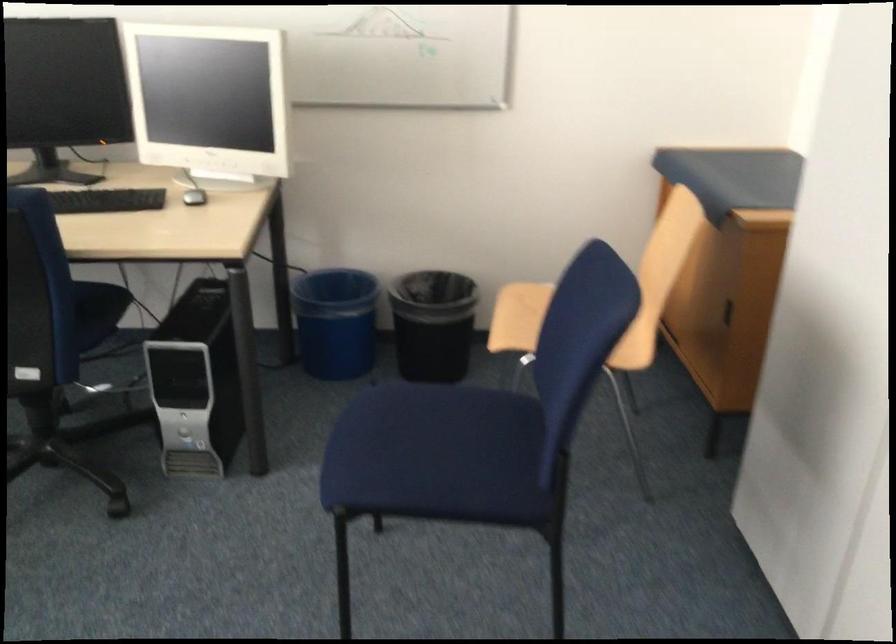
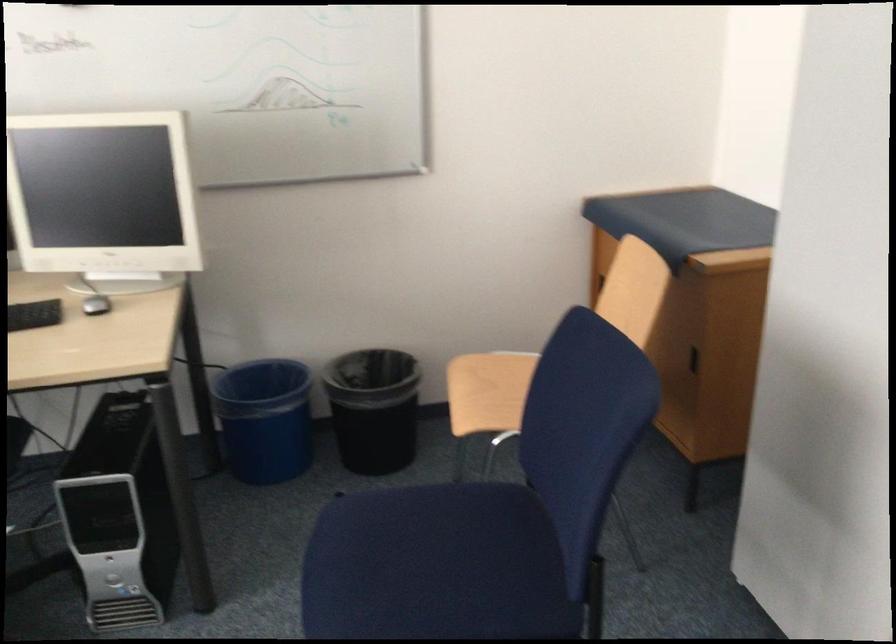
The images are taken continuously from a first-person perspective. In which direction are you moving?

The cameraman walked toward left, forward.